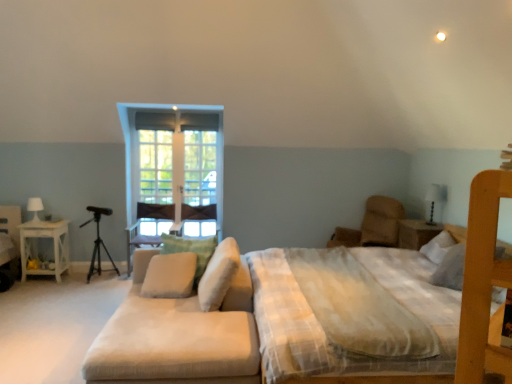
Question: Is black matte tripod at left smaller than white wood nightstand at right, which appears as the 2th nightstand when viewed from the left?

Choices:
 (A) yes
 (B) no

Answer: (B)

Question: Does black matte tripod at left come in front of white wood nightstand at right, which appears as the 2th nightstand when viewed from the left?

Choices:
 (A) yes
 (B) no

Answer: (B)

Question: From the image's perspective, does black matte tripod at left appear lower than white wood nightstand at right, which appears as the 2th nightstand when viewed from the left?

Choices:
 (A) no
 (B) yes

Answer: (B)

Question: Is there a large distance between black matte tripod at left and white wood nightstand at right, which appears as the 2th nightstand when viewed from the left?

Choices:
 (A) no
 (B) yes

Answer: (B)

Question: Can you confirm if black matte tripod at left is thinner than white wood nightstand at right, which is the first nightstand in right-to-left order?

Choices:
 (A) yes
 (B) no

Answer: (A)

Question: Can we say black matte tripod at left lies outside white wood nightstand at right, which appears as the 2th nightstand when viewed from the left?

Choices:
 (A) no
 (B) yes

Answer: (B)

Question: From the image's perspective, does clear glass window at center appear lower than white soft mattress at center?

Choices:
 (A) yes
 (B) no

Answer: (B)

Question: Can white soft mattress at center be found inside clear glass window at center?

Choices:
 (A) no
 (B) yes

Answer: (A)

Question: Considering the relative sizes of clear glass window at center and white soft mattress at center in the image provided, is clear glass window at center smaller than white soft mattress at center?

Choices:
 (A) no
 (B) yes

Answer: (B)

Question: Considering the relative sizes of clear glass window at center and white soft mattress at center in the image provided, is clear glass window at center thinner than white soft mattress at center?

Choices:
 (A) no
 (B) yes

Answer: (B)

Question: From the image's perspective, would you say clear glass window at center is positioned over white soft mattress at center?

Choices:
 (A) yes
 (B) no

Answer: (A)

Question: From a real-world perspective, is clear glass window at center below white soft mattress at center?

Choices:
 (A) yes
 (B) no

Answer: (B)

Question: Would you say white glossy table lamp at upper right, which appears as the first table lamp when viewed from the front, is part of white soft pillow at center, acting as the third pillow starting from the left,'s contents?

Choices:
 (A) no
 (B) yes

Answer: (A)